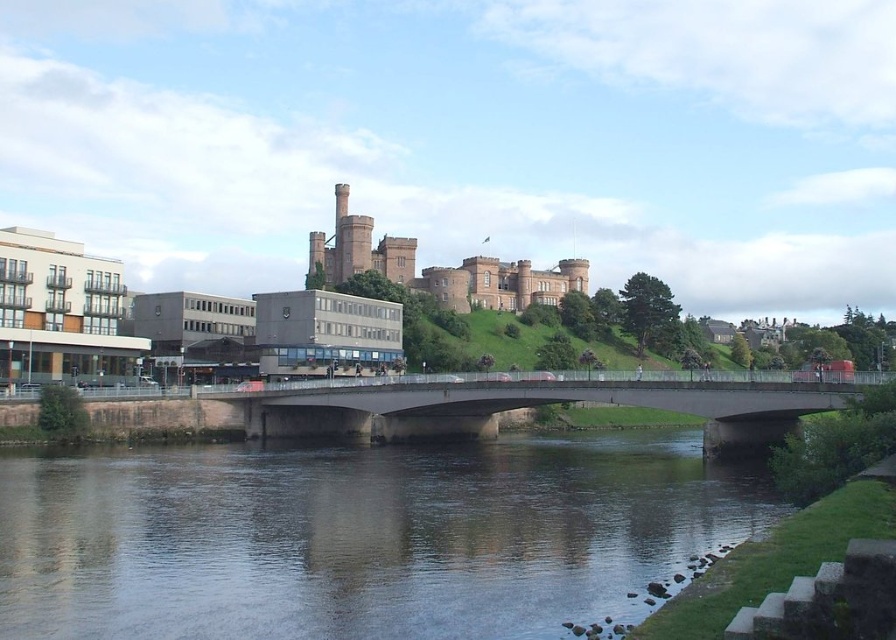
Does dark gray water at center have a greater width compared to concrete bridge at center?

Indeed, dark gray water at center has a greater width compared to concrete bridge at center.

Can you confirm if dark gray water at center is positioned to the right of concrete bridge at center?

No, dark gray water at center is not to the right of concrete bridge at center.

Between point (623, 600) and point (625, 397), which one is positioned in front?

Point (623, 600) is more forward.

At what (x,y) coordinates should I click in order to perform the action: click on dark gray water at center. Please return your answer as a coordinate pair (x, y). Image resolution: width=896 pixels, height=640 pixels. Looking at the image, I should click on (358, 536).